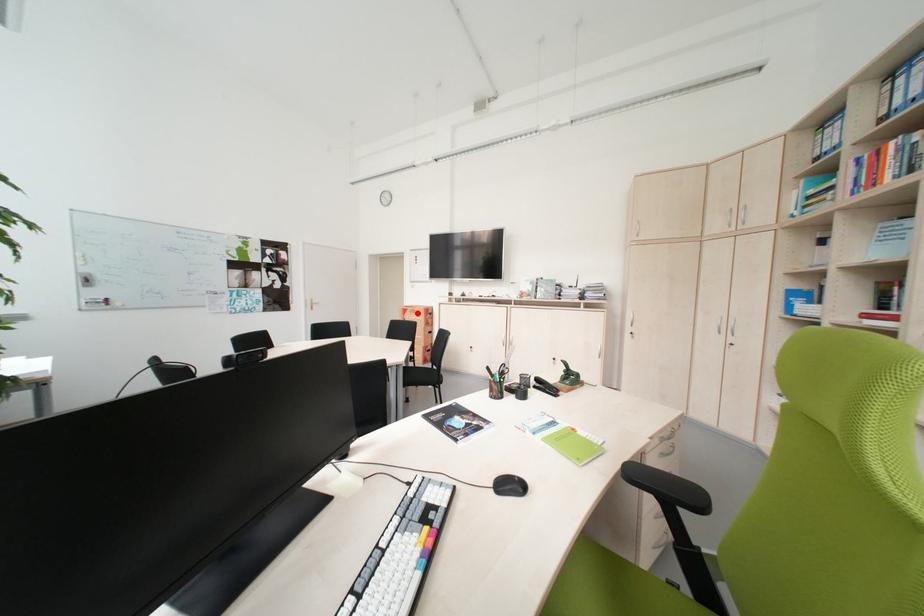
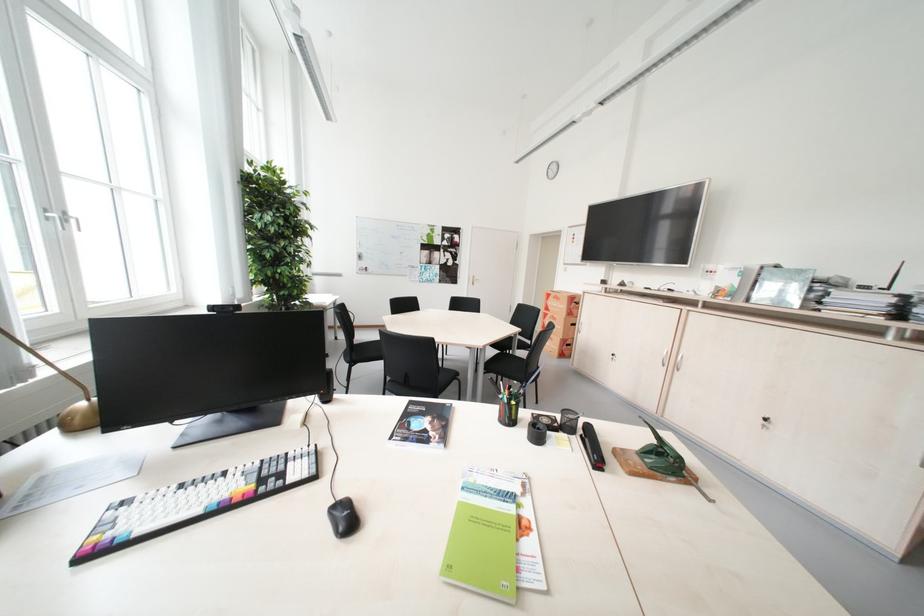
Question: I am providing you with two images of the same scene from different viewpoints. In image1, a red point is highlighted. Considering the same 3D point in image2, which of the following is correct?

Choices:
 (A) It is closer
 (B) It is farther

Answer: (A)